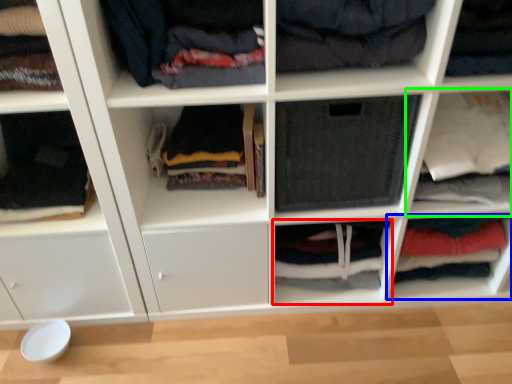
Question: Estimate the real-world distances between objects in this image. Which object is closer to cabinet (highlighted by a red box), cabinet (highlighted by a blue box) or shelf (highlighted by a green box)?

Choices:
 (A) cabinet
 (B) shelf

Answer: (A)